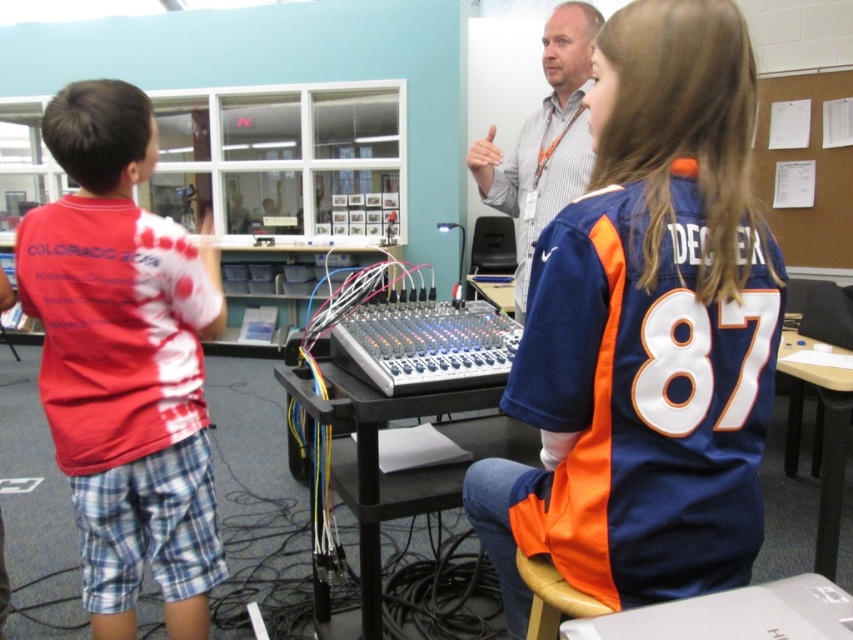
Question: Can you confirm if blue/orange jersey at center is wider than striped shirt at upper center?

Choices:
 (A) no
 (B) yes

Answer: (B)

Question: Does tie-dye t-shirt at left appear on the left side of striped shirt at upper center?

Choices:
 (A) yes
 (B) no

Answer: (A)

Question: Which point is farther from the camera taking this photo?

Choices:
 (A) (541, 132)
 (B) (51, 416)
 (C) (514, 605)

Answer: (A)

Question: Which object is positioned farthest from the striped shirt at upper center?

Choices:
 (A) blue/orange jersey at center
 (B) tie-dye t-shirt at left

Answer: (B)

Question: Which point is closer to the camera?

Choices:
 (A) tie-dye t-shirt at left
 (B) striped shirt at upper center
 (C) blue/orange jersey at center

Answer: (C)

Question: Can you confirm if tie-dye t-shirt at left is positioned to the right of striped shirt at upper center?

Choices:
 (A) yes
 (B) no

Answer: (B)